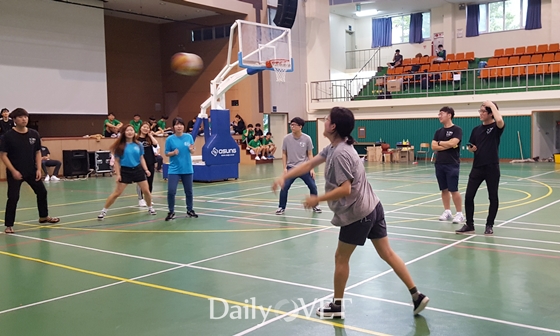
The image size is (560, 336). Identify the location of mop. (521, 157).